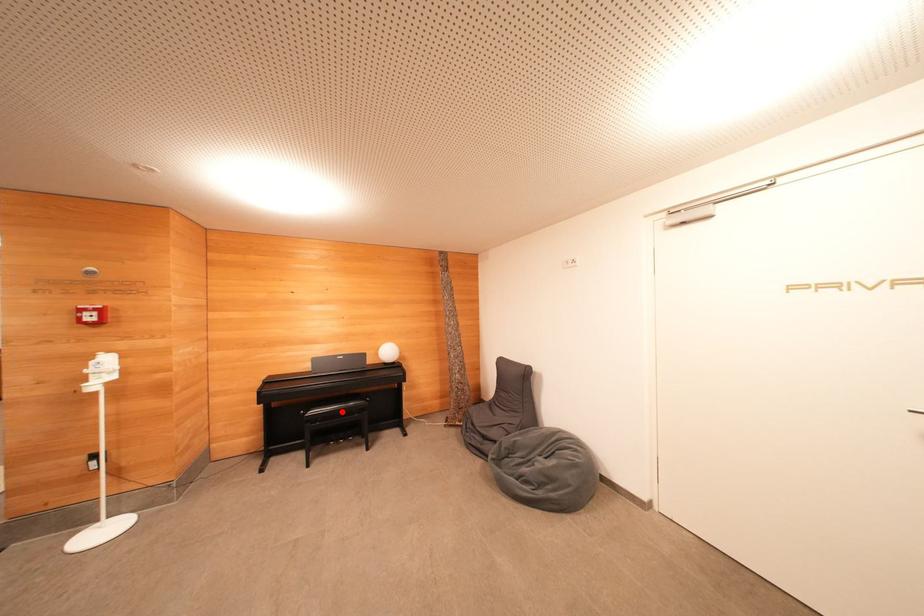
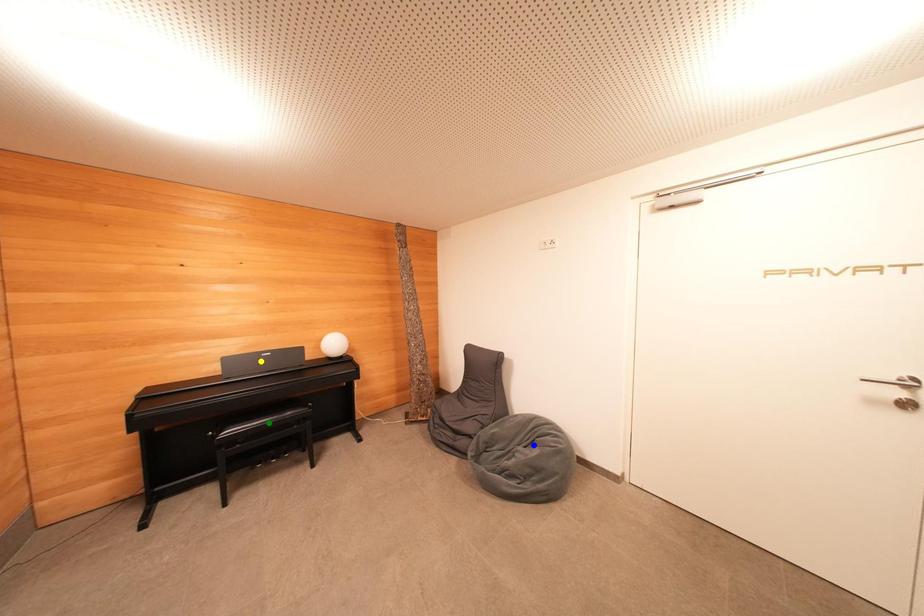
Question: I am providing you with two images of the same scene from different viewpoints. A red point is marked on the first image. You are given multiple points on the second image. Which mark in image 2 goes with the point in image 1?

Choices:
 (A) green point
 (B) blue point
 (C) yellow point

Answer: (A)